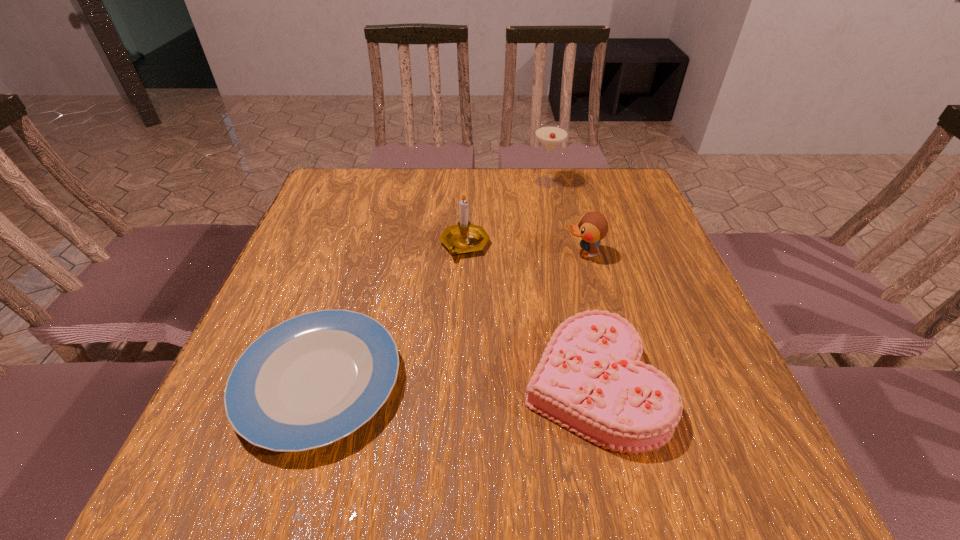
Image resolution: width=960 pixels, height=540 pixels. I want to click on empty location between the third shortest object and the plate, so click(451, 318).

At what (x,y) coordinates should I click in order to perform the action: click on blank region between the duck and the martini. Please return your answer as a coordinate pair (x, y). Looking at the image, I should click on (564, 218).

Where is `empty location between the martini and the candle holder`? empty location between the martini and the candle holder is located at coordinates (505, 213).

The height and width of the screenshot is (540, 960). Identify the location of vacant space that is in between the third shortest object and the fourth object from right to left. (524, 249).

Where is `vacant point located between the cake and the second object from left to right`? The height and width of the screenshot is (540, 960). vacant point located between the cake and the second object from left to right is located at coordinates (528, 314).

Identify the location of empty space between the third shortest object and the leftmost object. The width and height of the screenshot is (960, 540). (451, 318).

Locate an element on the screen. The image size is (960, 540). object identified as the second closest to the martini is located at coordinates (592, 227).

Choose which object is the fourth nearest neighbor to the duck. Please provide its 2D coordinates. Your answer should be formatted as a tuple, i.e. [(x, y)], where the tuple contains the x and y coordinates of a point satisfying the conditions above.

[(316, 378)]

Locate an element on the screen. free spot that satisfies the following two spatial constraints: 1. on the front side of the second object from left to right; 2. on the right side of the cake is located at coordinates (459, 384).